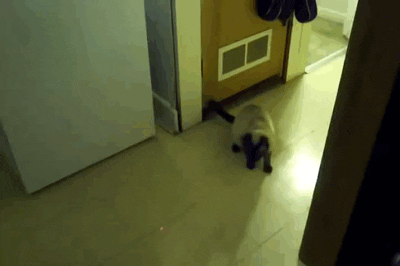
Where is `refrigerator`? This screenshot has height=266, width=400. refrigerator is located at coordinates (62, 74).